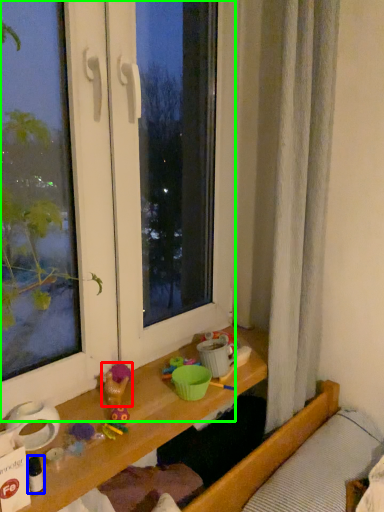
Question: Which is farther away from toy (highlighted by a red box)? toy (highlighted by a blue box) or window (highlighted by a green box)?

Choices:
 (A) toy
 (B) window

Answer: (B)